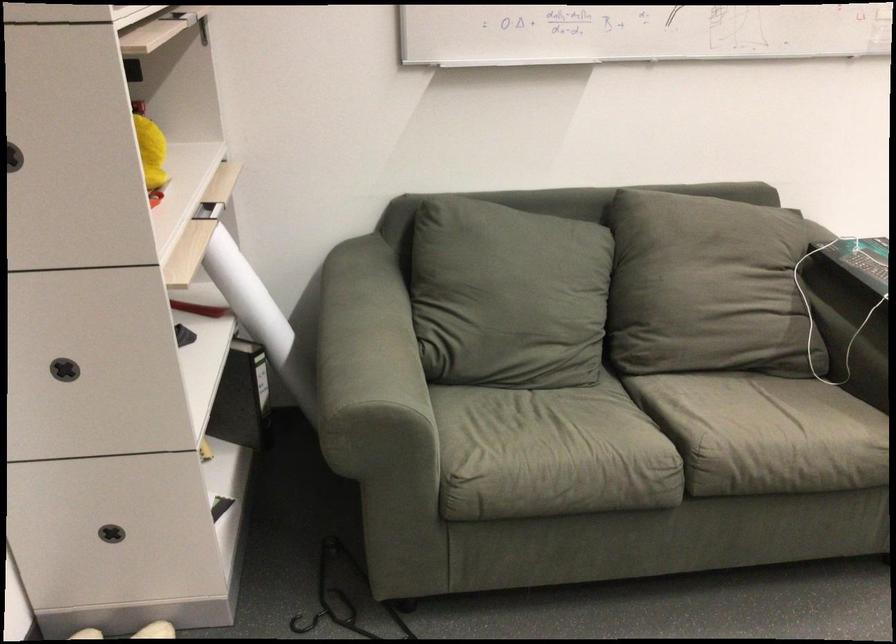
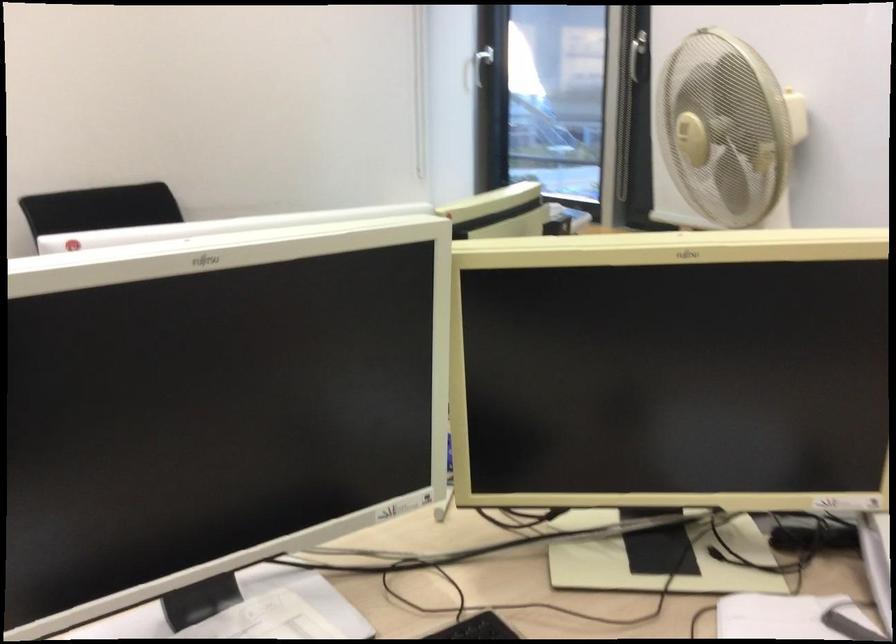
Question: What movement of the cameraman would produce the second image?

Choices:
 (A) Left
 (B) Right
 (C) Forward
 (D) Backward

Answer: (B)